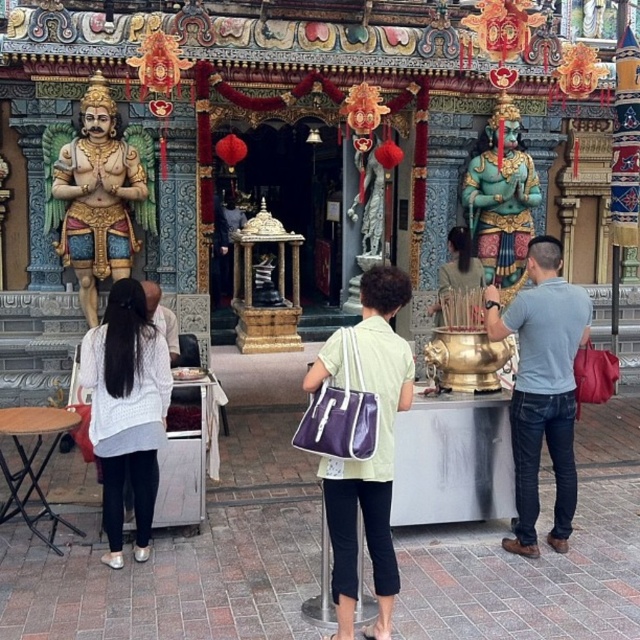
You are a visitor at the temple and want to place your items on the altar. The altar is elevated, so you need to reach it from the red brick area. Which item, the purple fabric bag at center or the white knitted sweater at left, is easier to reach from your current position?

The purple fabric bag at center is easier to reach because it is closer to the viewer than the white knitted sweater at left.

Based on the photo, you are a tourist visiting the temple and want to take a photo of both the blue denim jeans at right and the gold polished statue at left. Which object should you position closer to the camera to ensure both are in the frame?

To ensure both the blue denim jeans at right and the gold polished statue at left are in the frame, position the gold polished statue at left closer to the camera since it is to the left of the blue denim jeans at right.